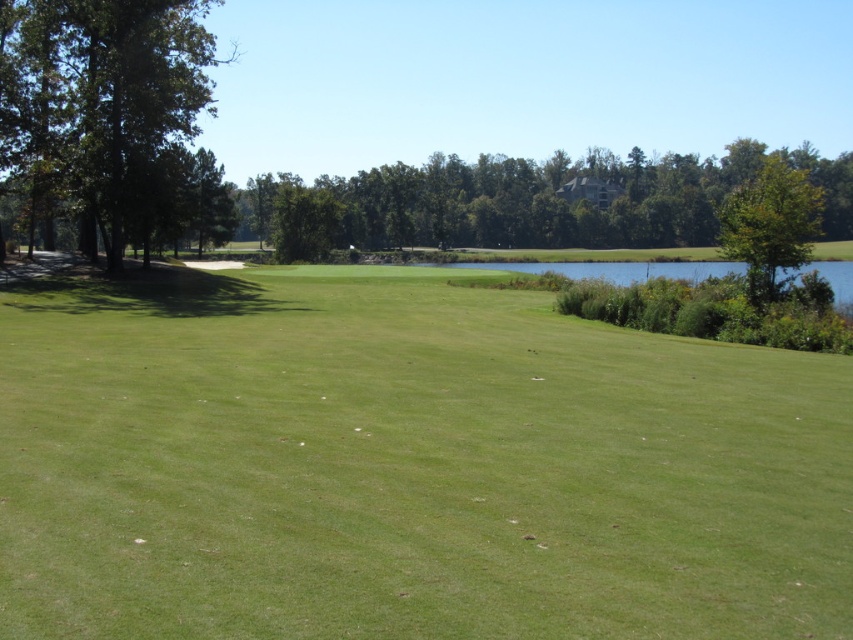
Question: Does green leafy tree at left have a larger size compared to green leafy tree at center?

Choices:
 (A) no
 (B) yes

Answer: (A)

Question: Which object appears farthest from the camera in this image?

Choices:
 (A) green leafy tree at center
 (B) green grass at center
 (C) green leafy tree at left

Answer: (A)

Question: Does green leafy tree at left have a smaller size compared to green leafy tree at center?

Choices:
 (A) yes
 (B) no

Answer: (A)

Question: Estimate the real-world distances between objects in this image. Which object is closer to the green leafy tree at center?

Choices:
 (A) green grass at center
 (B) green leafy tree at left
 (C) green leafy tree at upper right

Answer: (C)

Question: Among these points, which one is farthest from the camera?

Choices:
 (A) (840, 193)
 (B) (781, 157)
 (C) (543, 513)
 (D) (119, 29)

Answer: (B)

Question: Is green grass at center further to camera compared to green leafy tree at center?

Choices:
 (A) no
 (B) yes

Answer: (A)